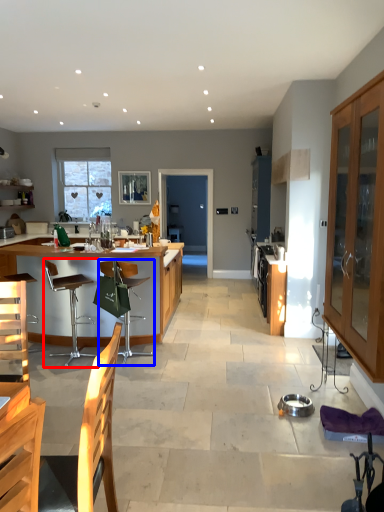
Question: Which object appears closest to the camera in this image, chair (highlighted by a red box) or chair (highlighted by a blue box)?

Choices:
 (A) chair
 (B) chair

Answer: (A)